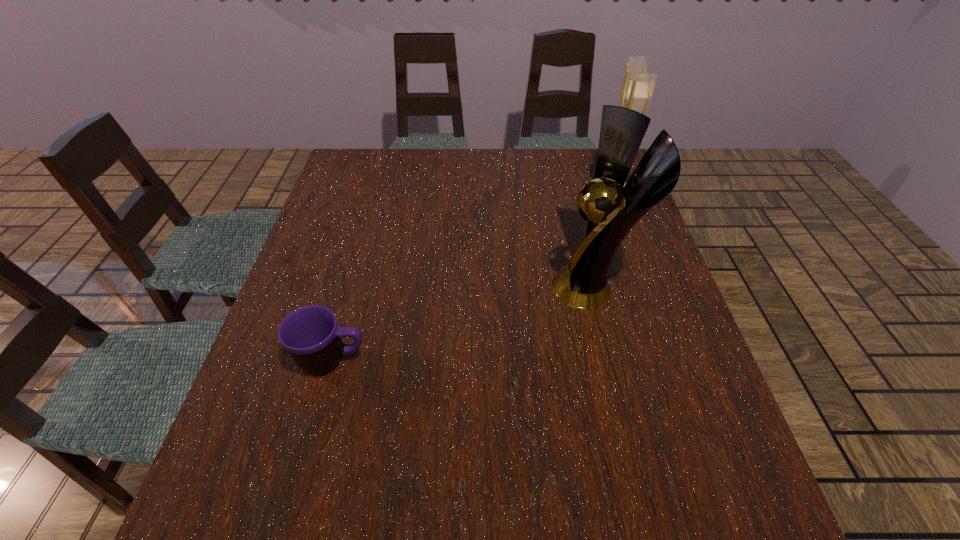
Where is `vacant space that's between the shortest object and the second nearest object`? vacant space that's between the shortest object and the second nearest object is located at coordinates (463, 323).

This screenshot has height=540, width=960. Find the location of `free area in between the farther award and the leftmost object`. free area in between the farther award and the leftmost object is located at coordinates (471, 276).

This screenshot has height=540, width=960. I want to click on free space between the farthest object and the shortest object, so click(x=471, y=276).

Locate an element on the screen. free space between the farthest object and the leftmost object is located at coordinates (471, 276).

Locate an element on the screen. The height and width of the screenshot is (540, 960). free space between the nearer award and the shortest object is located at coordinates (463, 323).

Where is `free space that is in between the shortest object and the farther award`? Image resolution: width=960 pixels, height=540 pixels. free space that is in between the shortest object and the farther award is located at coordinates click(471, 276).

This screenshot has height=540, width=960. Find the location of `object that is the closest to the nearest object`. object that is the closest to the nearest object is located at coordinates (613, 209).

Point out which object is positioned as the second nearest to the mug. Please provide its 2D coordinates. Your answer should be formatted as a tuple, i.e. [(x, y)], where the tuple contains the x and y coordinates of a point satisfying the conditions above.

[(637, 88)]